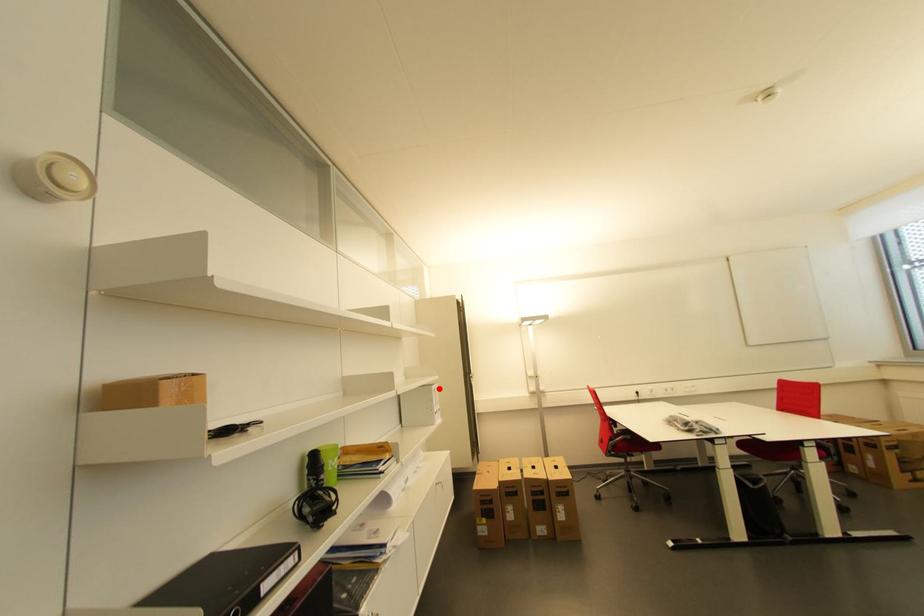
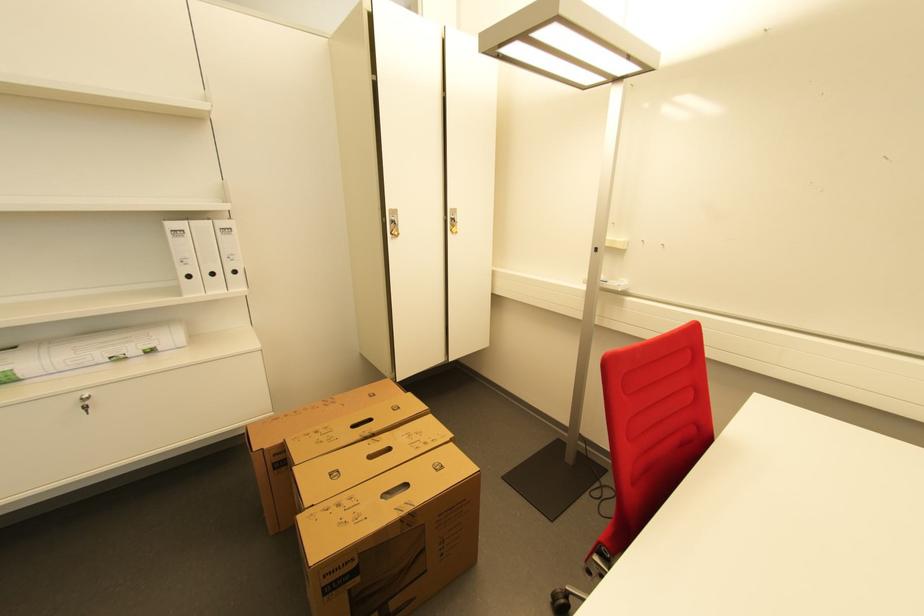
Where in the second image is the point corresponding to the highlighted location from the first image?

(176, 225)